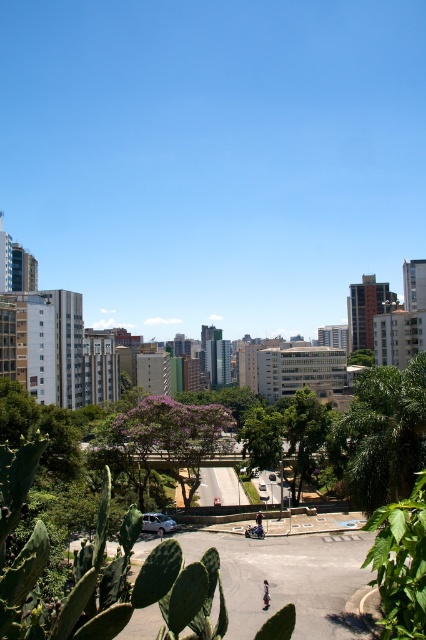
Question: Among these objects, which one is farthest from the camera?

Choices:
 (A) green leafy tree at center
 (B) white matte van at center

Answer: (A)

Question: Is light brown leather jacket at center below dark blue jeans at center?

Choices:
 (A) yes
 (B) no

Answer: (A)

Question: Which point is farther to the camera?

Choices:
 (A) (267, 593)
 (B) (258, 520)
 (C) (147, 529)

Answer: (C)

Question: Is green leafy tree at center above purple leafy tree at center?

Choices:
 (A) no
 (B) yes

Answer: (B)

Question: Among these objects, which one is nearest to the camera?

Choices:
 (A) purple leafy tree at center
 (B) green leafy tree at center
 (C) white matte van at center

Answer: (C)

Question: Does purple leafy tree at center lie in front of light brown leather jacket at center?

Choices:
 (A) yes
 (B) no

Answer: (B)